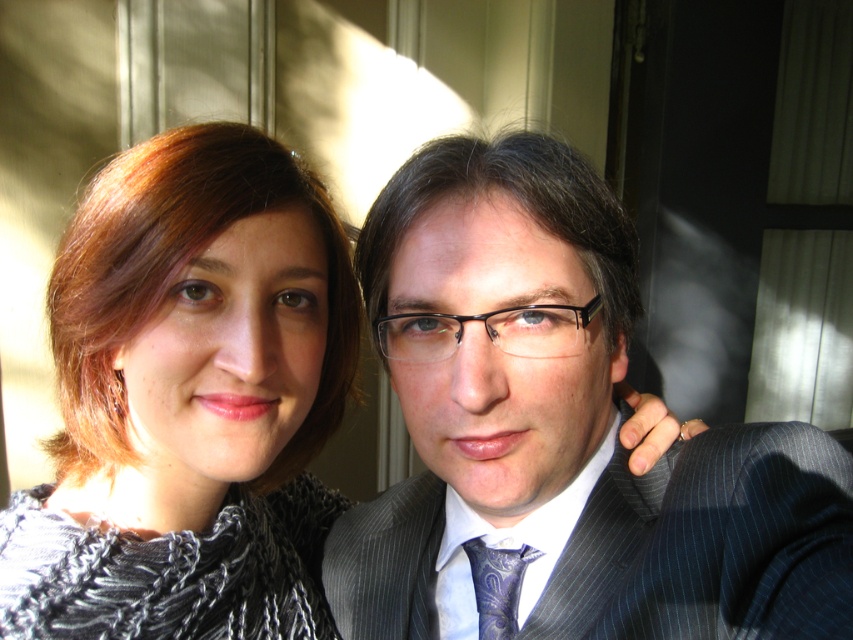
Question: Does dark gray pinstripe suit at center appear on the right side of paisley silk tie at center?

Choices:
 (A) no
 (B) yes

Answer: (B)

Question: Which object is farther from the camera taking this photo?

Choices:
 (A) pinstriped fabric suit at center
 (B) paisley silk tie at center

Answer: (B)

Question: Which object is closer to the camera taking this photo?

Choices:
 (A) knitted gray sweater at left
 (B) dark gray pinstripe suit at center
 (C) pinstriped fabric suit at center
 (D) paisley silk tie at center

Answer: (B)

Question: Does dark gray pinstripe suit at center appear under pinstriped fabric suit at center?

Choices:
 (A) yes
 (B) no

Answer: (B)

Question: Which of the following is the farthest from the observer?

Choices:
 (A) dark gray pinstripe suit at center
 (B) paisley silk tie at center

Answer: (B)

Question: Does knitted gray sweater at left appear over paisley silk tie at center?

Choices:
 (A) no
 (B) yes

Answer: (B)